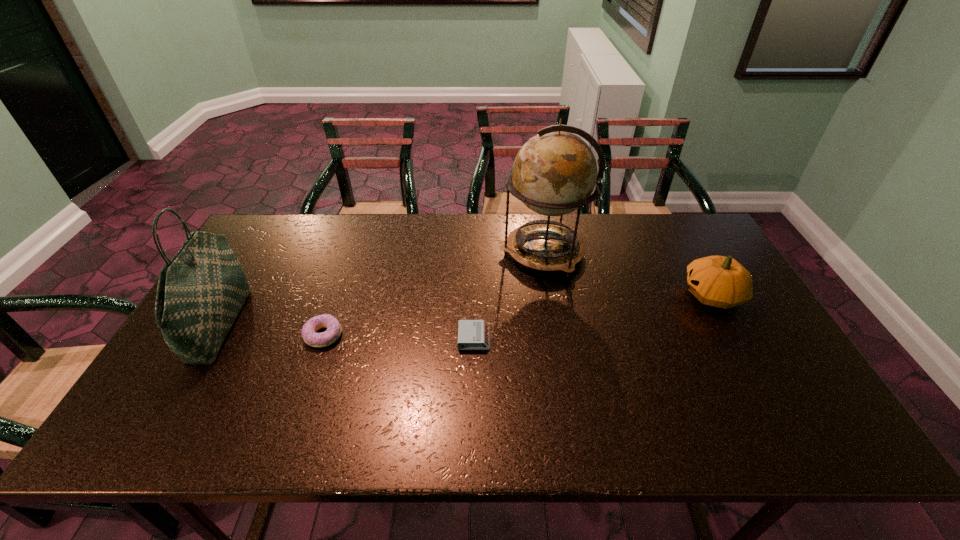
This screenshot has height=540, width=960. What are the coordinates of `empty location between the third object from right to left and the globe` in the screenshot? It's located at (509, 295).

I want to click on unoccupied area between the doughnut and the shortest object, so click(x=398, y=336).

The width and height of the screenshot is (960, 540). Identify the location of free spot between the tallest object and the leftmost object. (382, 288).

Find the location of a particular element. This screenshot has height=540, width=960. vacant space in between the alarm clock and the fourth object from left to right is located at coordinates (509, 295).

At what (x,y) coordinates should I click in order to perform the action: click on vacant region between the gourd and the shortest object. Please return your answer as a coordinate pair (x, y). The height and width of the screenshot is (540, 960). Looking at the image, I should click on (593, 317).

Find the location of `free space that is in between the alarm clock and the doughnut`. free space that is in between the alarm clock and the doughnut is located at coordinates (398, 336).

Identify the location of free space between the third object from left to right and the globe. This screenshot has height=540, width=960. (509, 295).

The image size is (960, 540). I want to click on object that is the closest to the doughnut, so click(201, 290).

Locate which object is the closest to the shortest object. Please provide its 2D coordinates. Your answer should be formatted as a tuple, i.e. [(x, y)], where the tuple contains the x and y coordinates of a point satisfying the conditions above.

[(554, 173)]

Locate an element on the screen. The image size is (960, 540). free space that satisfies the following two spatial constraints: 1. at the center of the tallest object; 2. on the front side of the fourth object from right to left is located at coordinates (558, 335).